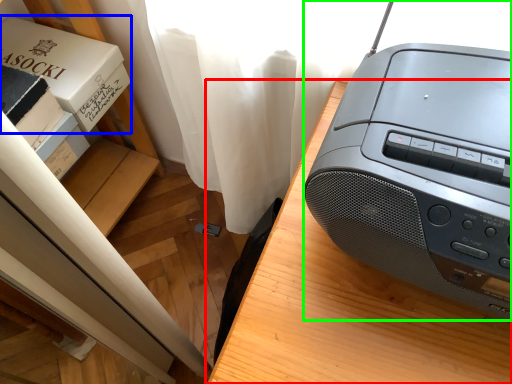
Question: Which object is positioned farthest from furniture (highlighted by a red box)? Select from paperback book (highlighted by a blue box) and printer (highlighted by a green box).

Choices:
 (A) paperback book
 (B) printer

Answer: (A)